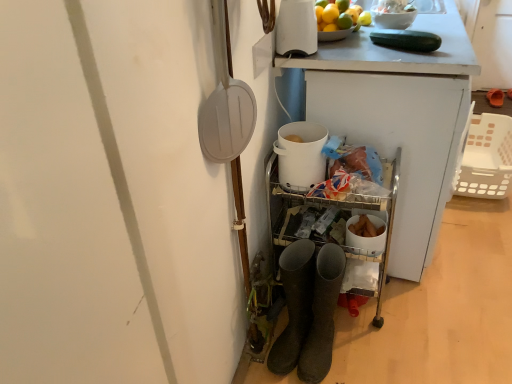
Locate an element on the screen. free space above white matte bucket at center, the 1th appliance ordered from the bottom (from a real-world perspective) is located at coordinates pyautogui.click(x=296, y=137).